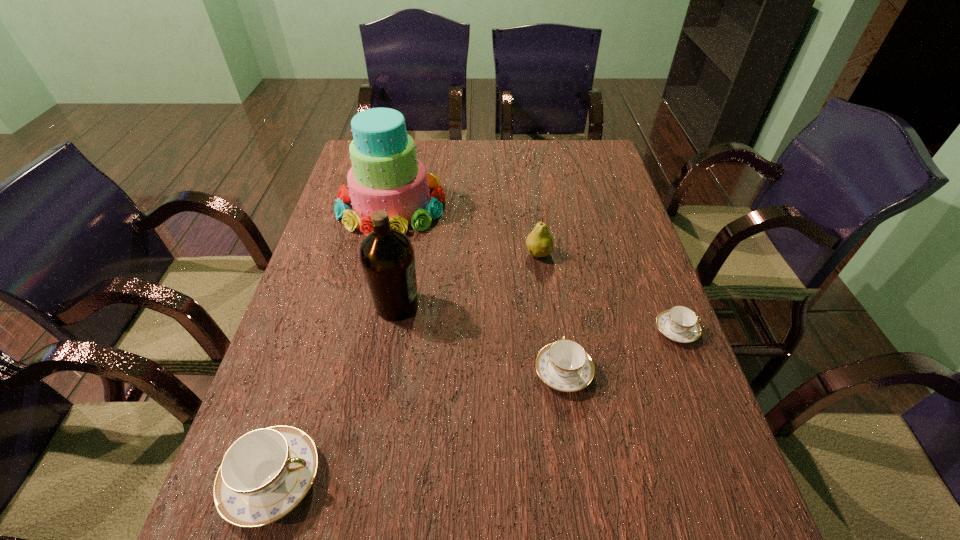
Find the location of a particular element. This screenshot has width=960, height=540. cake located at the left edge is located at coordinates 386,175.

At what (x,y) coordinates should I click in order to perform the action: click on object positioned at the right edge. Please return your answer as a coordinate pair (x, y). Image resolution: width=960 pixels, height=540 pixels. Looking at the image, I should click on (680, 324).

At what (x,y) coordinates should I click in order to perform the action: click on object that is at the far left corner. Please return your answer as a coordinate pair (x, y). Looking at the image, I should click on (386, 175).

In order to click on object positioned at the near left corner in this screenshot , I will do `click(266, 473)`.

At what (x,y) coordinates should I click in order to perform the action: click on vacant space at the far edge of the desktop. Please return your answer as a coordinate pair (x, y). This screenshot has width=960, height=540. Looking at the image, I should click on (549, 168).

The height and width of the screenshot is (540, 960). In the image, there is a desktop. What are the coordinates of `vacant space at the near edge` in the screenshot? It's located at click(473, 467).

You are a GUI agent. You are given a task and a screenshot of the screen. Output one action in this format:
    pyautogui.click(x=<x>, y=<y>)
    Task: Click on the free space at the left edge of the desktop
    
    Given the screenshot: What is the action you would take?
    pyautogui.click(x=331, y=262)

At what (x,y) coordinates should I click in order to perform the action: click on free space at the near left corner of the desktop. Please return your answer as a coordinate pair (x, y). This screenshot has height=540, width=960. Looking at the image, I should click on (318, 469).

The image size is (960, 540). Identify the location of free space at the far right corner of the desktop. (598, 153).

Where is `free space between the cake and the rightmost object`? The width and height of the screenshot is (960, 540). free space between the cake and the rightmost object is located at coordinates pos(534,268).